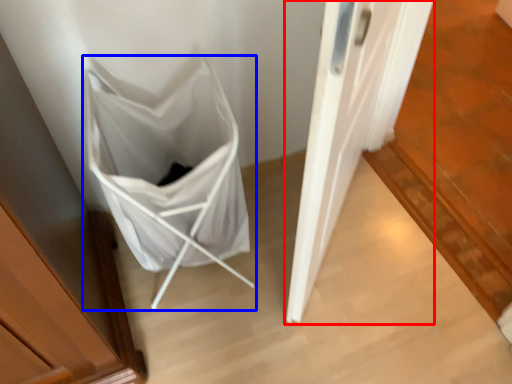
Question: Which point is closer to the camera, door (highlighted by a red box) or folding chair (highlighted by a blue box)?

Choices:
 (A) door
 (B) folding chair

Answer: (A)